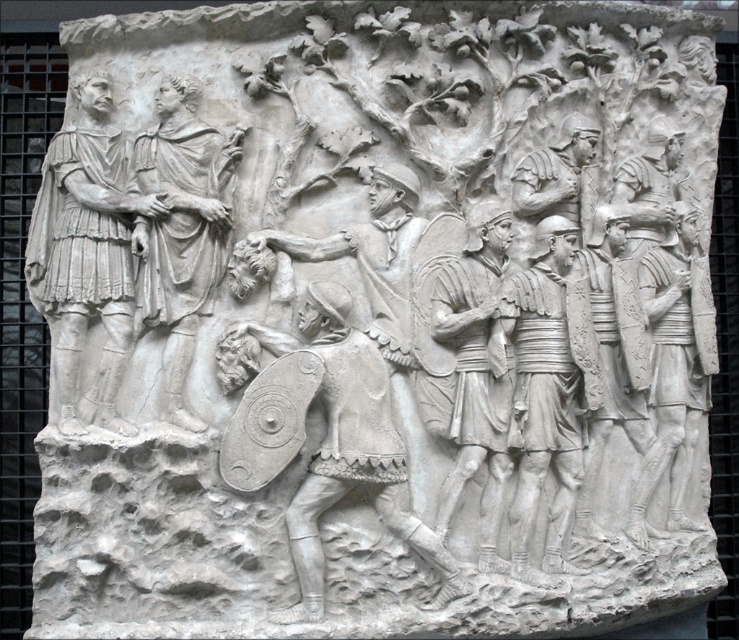
Between white stone shield at center and white stone soldiers at center, which one has more height?

white stone soldiers at center is taller.

Is point (423, 531) more distant than point (551, 513)?

No, it is not.

Identify the location of white stone shield at center. The image size is (739, 640). (353, 452).

Can you confirm if white stone figure at left is thinner than white stone shield at center?

Yes, white stone figure at left is thinner than white stone shield at center.

Can you confirm if white stone figure at left is bigger than white stone shield at center?

No, white stone figure at left is not bigger than white stone shield at center.

Between point (180, 104) and point (337, 499), which one is positioned in front?

Point (337, 499)

At what (x,y) coordinates should I click in order to perform the action: click on white stone figure at left. Please return your answer as a coordinate pair (x, y). Looking at the image, I should click on (180, 227).

Can you confirm if white stone soldier at left is positioned to the right of white stone shield at center?

In fact, white stone soldier at left is to the left of white stone shield at center.

Measure the distance between point (x=84, y=118) and camera.

A distance of 7.36 meters exists between point (x=84, y=118) and camera.

Find the location of a particular element. This screenshot has height=640, width=739. white stone soldier at left is located at coordinates (86, 250).

Find the location of `white stone soldier at left`. white stone soldier at left is located at coordinates (86, 250).